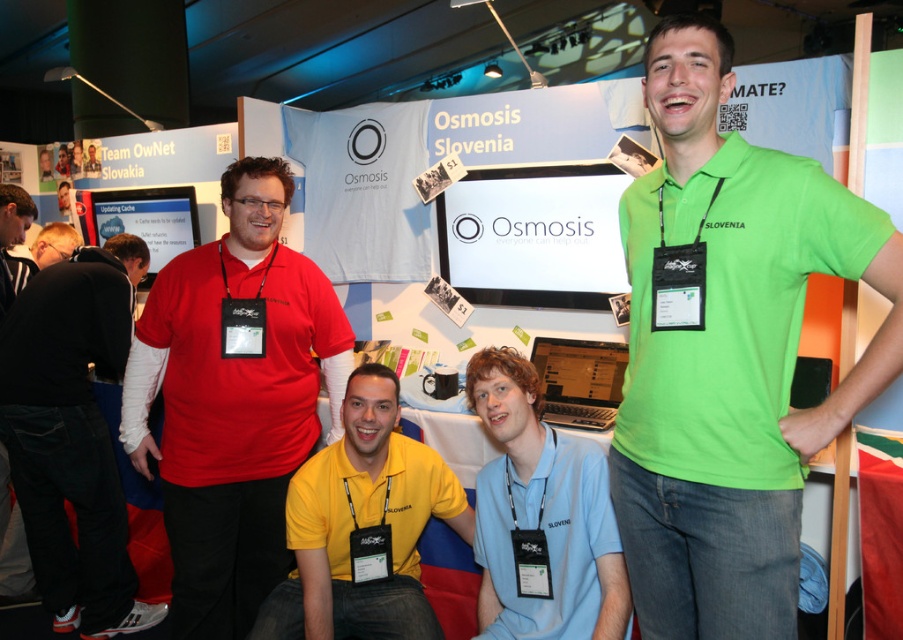
Question: Is green cotton shirt at center to the left of light blue fabric at center from the viewer's perspective?

Choices:
 (A) no
 (B) yes

Answer: (A)

Question: Estimate the real-world distances between objects in this image. Which object is closer to the matte red shirt at center?

Choices:
 (A) light blue fabric at center
 (B) yellow matte shirt at center
 (C) green cotton shirt at center

Answer: (B)

Question: Can you confirm if green cotton shirt at center is wider than light blue fabric at center?

Choices:
 (A) no
 (B) yes

Answer: (A)

Question: Which point is farther to the camera?

Choices:
 (A) (128, 589)
 (B) (258, 397)

Answer: (A)

Question: Can you confirm if matte red shirt at center is positioned to the left of yellow matte shirt at center?

Choices:
 (A) yes
 (B) no

Answer: (A)

Question: Which object appears closest to the camera in this image?

Choices:
 (A) black fabric jacket at left
 (B) matte red shirt at center

Answer: (B)